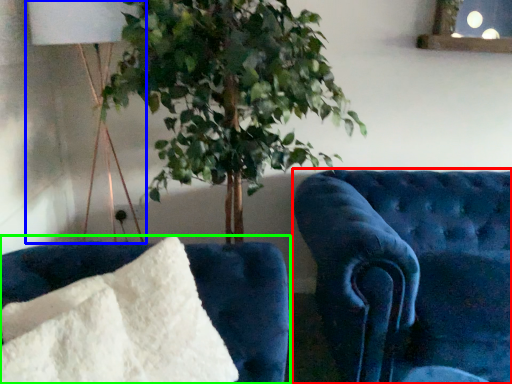
Question: Based on their relative distances, which object is farther from furniture (highlighted by a red box)? Choose from table lamp (highlighted by a blue box) and furniture (highlighted by a green box).

Choices:
 (A) table lamp
 (B) furniture

Answer: (A)